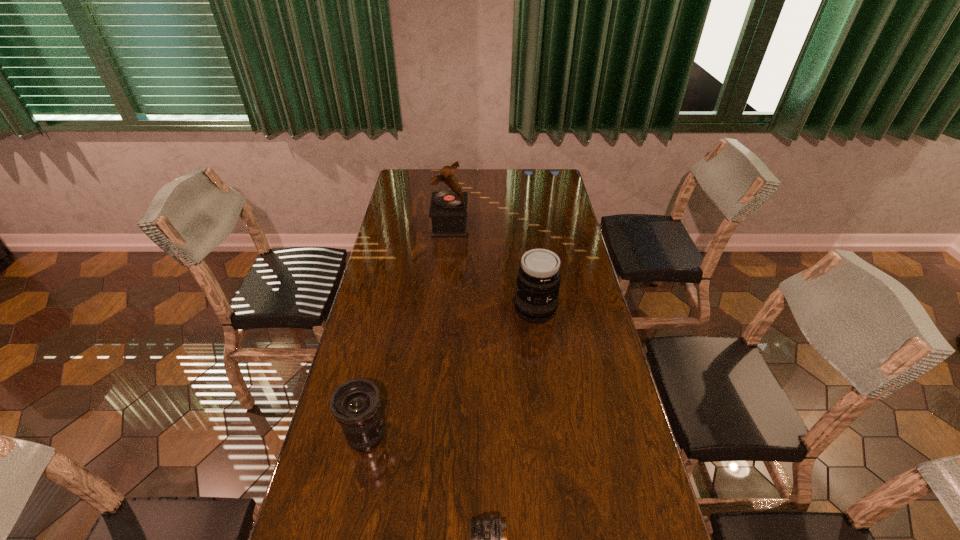
Where is `the farthest object`? The height and width of the screenshot is (540, 960). the farthest object is located at coordinates (448, 210).

Identify the location of the third object from right to left. This screenshot has height=540, width=960. (448, 210).

This screenshot has width=960, height=540. I want to click on the rightmost telephoto lens, so click(536, 300).

This screenshot has width=960, height=540. Identify the location of the farthest telephoto lens. (536, 300).

You are a GUI agent. You are given a task and a screenshot of the screen. Output one action in this format:
    pyautogui.click(x=<x>, y=<y>)
    Task: Click on the second nearest object
    This screenshot has height=540, width=960.
    Given the screenshot: What is the action you would take?
    pyautogui.click(x=355, y=404)

Identify the location of the second tallest telephoto lens. Image resolution: width=960 pixels, height=540 pixels. (355, 404).

Where is `free point located 0.260m at the horn opening of the tallest object`? The width and height of the screenshot is (960, 540). free point located 0.260m at the horn opening of the tallest object is located at coordinates (528, 225).

The width and height of the screenshot is (960, 540). Find the location of `free region located 0.170m on the left of the rightmost object`. free region located 0.170m on the left of the rightmost object is located at coordinates (465, 310).

Identify the location of vacant area located on the front of the second nearest object. This screenshot has width=960, height=540. (355, 489).

Locate an element on the screen. object that is at the left edge is located at coordinates (355, 404).